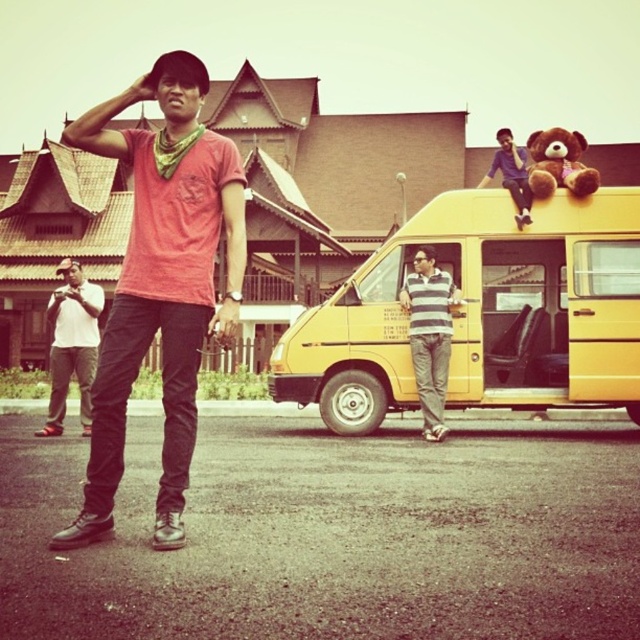
You are standing at point (538, 196) and want to walk to point (520, 244). Which direction should you move in?

You should move forward because point (520, 244) is behind point (538, 196).

You are a photographer trying to capture a clear shot of both the white matte shirt at left and the brown plush bear at upper right. Which object will appear closer to the camera in the photo?

The white matte shirt at left will appear closer to the camera because it is in front of the brown plush bear at upper right.

You are a photographer trying to capture a group photo. You notice two people in the scene wearing a white matte shirt at left and a blue striped shirt at upper right. Which person should you ask to move closer to ensure they appear larger in the photo?

The white matte shirt at left is smaller in size compared to the blue striped shirt at upper right. To ensure they appear larger in the photo, you should ask the person wearing the white matte shirt at left to move closer.